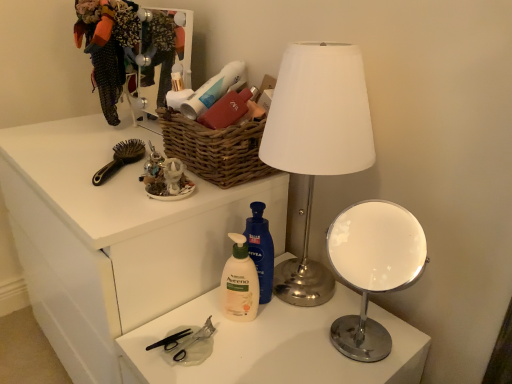
At what (x,y) coordinates should I click in order to perform the action: click on free location to the left of patterned fabric dress at upper left. Please return your answer as a coordinate pair (x, y). Looking at the image, I should click on (61, 127).